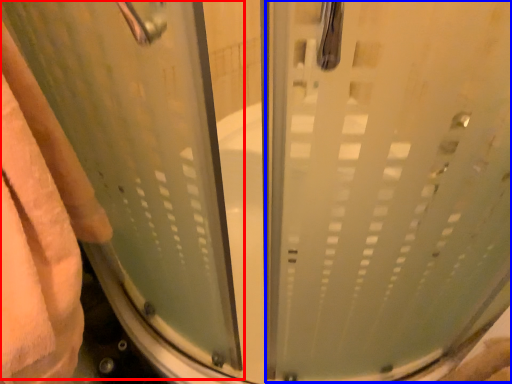
Question: Among these objects, which one is nearest to the camera, screen door (highlighted by a red box) or screen door (highlighted by a blue box)?

Choices:
 (A) screen door
 (B) screen door

Answer: (A)